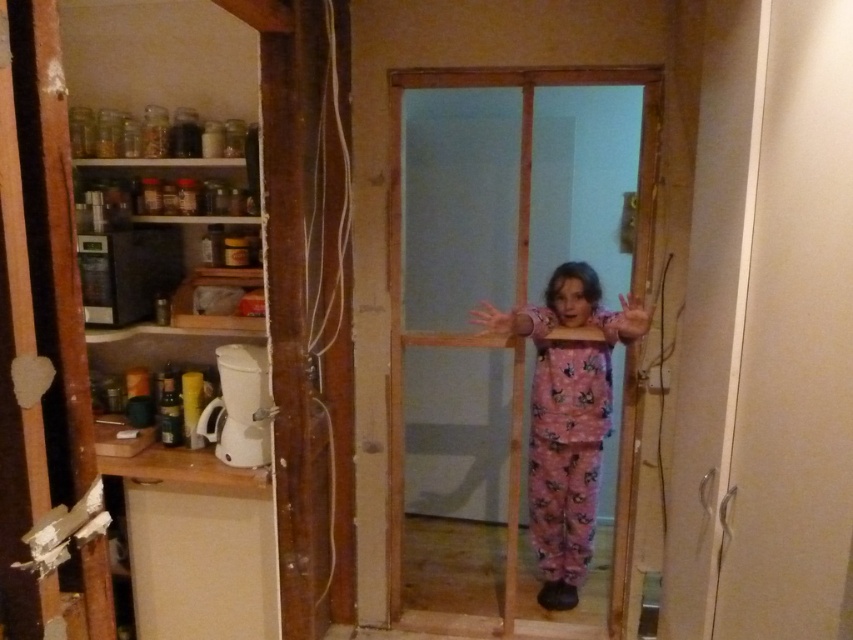
Which of these two, white matte pantry at left or pink cotton pajamas at center, stands taller?

white matte pantry at left

Does white matte pantry at left appear over pink cotton pajamas at center?

Yes.

Does point (41, 428) lie behind point (608, 433)?

No.

The image size is (853, 640). Find the location of `white matte pantry at left`. white matte pantry at left is located at coordinates (296, 288).

Between transparent glass door at center and white matte pantry at left, which one has less height?

white matte pantry at left

Who is positioned more to the left, transparent glass door at center or white matte pantry at left?

Positioned to the left is white matte pantry at left.

Locate an element on the screen. The width and height of the screenshot is (853, 640). transparent glass door at center is located at coordinates (506, 337).

Can you confirm if pink cotton pajamas at center is smaller than pink fuzzy jumpsuit at center?

Incorrect, pink cotton pajamas at center is not smaller in size than pink fuzzy jumpsuit at center.

Which is more to the left, pink cotton pajamas at center or pink fuzzy jumpsuit at center?

pink cotton pajamas at center

The width and height of the screenshot is (853, 640). I want to click on pink cotton pajamas at center, so click(x=566, y=419).